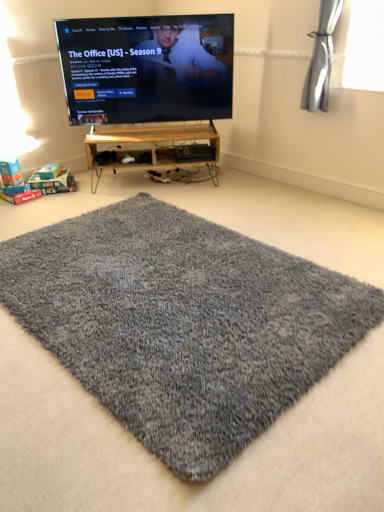
Question: Does point (140, 334) appear closer or farther from the camera than point (109, 142)?

Choices:
 (A) farther
 (B) closer

Answer: (B)

Question: Based on their sizes in the image, would you say gray shaggy rug at center is bigger or smaller than wooden shelf at center?

Choices:
 (A) big
 (B) small

Answer: (B)

Question: Which is nearer to the gray shaggy rug at center?

Choices:
 (A) matte black tv at upper center
 (B) wooden shelf at center

Answer: (B)

Question: Estimate the real-world distances between objects in this image. Which object is closer to the wooden shelf at center?

Choices:
 (A) gray shaggy rug at center
 (B) matte black tv at upper center

Answer: (B)